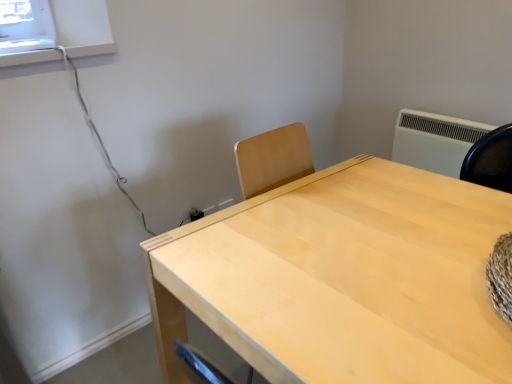
Image resolution: width=512 pixels, height=384 pixels. Find the location of `light wood table at center`. light wood table at center is located at coordinates [x=342, y=279].

What do you see at coordinates (342, 279) in the screenshot? I see `light wood table at center` at bounding box center [342, 279].

What do you see at coordinates (435, 141) in the screenshot?
I see `white plastic air conditioning unit at upper right` at bounding box center [435, 141].

Find the location of a particular element. white plastic air conditioning unit at upper right is located at coordinates (435, 141).

Find the location of `light wood table at center`. light wood table at center is located at coordinates (342, 279).

Is light wood table at center to the left or to the right of white plastic air conditioning unit at upper right in the image?

From the image, it's evident that light wood table at center is to the left of white plastic air conditioning unit at upper right.

Is light wood table at center closer to the viewer compared to white plastic air conditioning unit at upper right?

That is True.

Is point (499, 231) closer to camera compared to point (407, 110)?

Yes, point (499, 231) is closer to viewer.

From the image's perspective, between light wood table at center and white plastic air conditioning unit at upper right, which one is located above?

From the image's view, white plastic air conditioning unit at upper right is above.

From a real-world perspective, is light wood table at center located beneath white plastic air conditioning unit at upper right?

Yes, from a real-world perspective, light wood table at center is under white plastic air conditioning unit at upper right.

Is light wood table at center thinner than white plastic air conditioning unit at upper right?

No.

Between light wood table at center and white plastic air conditioning unit at upper right, which one has more height?

light wood table at center.

Between light wood table at center and white plastic air conditioning unit at upper right, which one has larger size?

With larger size is light wood table at center.

Is light wood table at center not within white plastic air conditioning unit at upper right?

Indeed, light wood table at center is completely outside white plastic air conditioning unit at upper right.

Does light wood table at center touch white plastic air conditioning unit at upper right?

No, light wood table at center is not with white plastic air conditioning unit at upper right.

Is light wood table at center oriented towards white plastic air conditioning unit at upper right?

No, light wood table at center is not turned towards white plastic air conditioning unit at upper right.

I want to click on table lying on the left of white plastic air conditioning unit at upper right, so click(342, 279).

Is white plastic air conditioning unit at upper right at the right side of light wood table at center?

Yes.

Considering their positions, is white plastic air conditioning unit at upper right located in front of or behind light wood table at center?

In the image, white plastic air conditioning unit at upper right appears behind light wood table at center.

Does point (450, 140) appear closer or farther from the camera than point (245, 347)?

Point (450, 140) appears to be farther away from the viewer than point (245, 347).

From the image's perspective, is white plastic air conditioning unit at upper right located above or below light wood table at center?

From the image's perspective, white plastic air conditioning unit at upper right appears above light wood table at center.

From a real-world perspective, who is located lower, white plastic air conditioning unit at upper right or light wood table at center?

From a 3D spatial view, light wood table at center is below.

Considering the relative sizes of white plastic air conditioning unit at upper right and light wood table at center in the image provided, is white plastic air conditioning unit at upper right wider than light wood table at center?

No.

Between white plastic air conditioning unit at upper right and light wood table at center, which one has less height?

Standing shorter between the two is white plastic air conditioning unit at upper right.

Between white plastic air conditioning unit at upper right and light wood table at center, which one has smaller size?

Smaller between the two is white plastic air conditioning unit at upper right.

Is white plastic air conditioning unit at upper right inside or outside of light wood table at center?

white plastic air conditioning unit at upper right lies outside light wood table at center.

Is white plastic air conditioning unit at upper right beside light wood table at center?

white plastic air conditioning unit at upper right and light wood table at center are clearly separated.

Is white plastic air conditioning unit at upper right aimed at light wood table at center?

Yes, white plastic air conditioning unit at upper right is oriented towards light wood table at center.

Looking at this image, how different are the orientations of white plastic air conditioning unit at upper right and light wood table at center in degrees?

The angular difference between white plastic air conditioning unit at upper right and light wood table at center is 0.822 degrees.

Measure the distance from white plastic air conditioning unit at upper right to light wood table at center.

They are 32.15 inches apart.

The height and width of the screenshot is (384, 512). I want to click on table that appears on the left of white plastic air conditioning unit at upper right, so click(x=342, y=279).

Identify the location of table located underneath the white plastic air conditioning unit at upper right (from a real-world perspective). This screenshot has width=512, height=384. (342, 279).

Image resolution: width=512 pixels, height=384 pixels. What are the coordinates of `air conditioning behind the light wood table at center` in the screenshot? It's located at (435, 141).